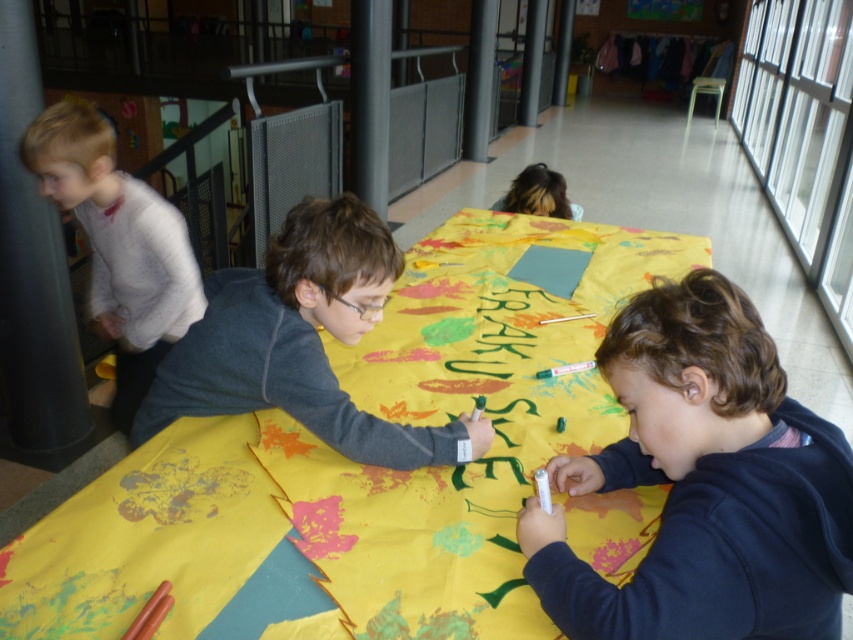
In the scene shown: Is yellow fabric at center smaller than dark blue sweatshirt at lower right?

Incorrect, yellow fabric at center is not smaller in size than dark blue sweatshirt at lower right.

Between yellow fabric at center and dark blue sweatshirt at lower right, which one is positioned lower?

dark blue sweatshirt at lower right is lower down.

Locate an element on the screen. yellow fabric at center is located at coordinates (361, 465).

Consider the image. Does dark blue sweatshirt at lower right have a larger size compared to blonde hair at upper center?

Correct, dark blue sweatshirt at lower right is larger in size than blonde hair at upper center.

Does dark blue sweatshirt at lower right have a smaller size compared to blonde hair at upper center?

Actually, dark blue sweatshirt at lower right might be larger than blonde hair at upper center.

Where is `dark blue sweatshirt at lower right`? dark blue sweatshirt at lower right is located at coordinates (704, 483).

Is dark blue sweatshirt at lower right bigger than white speckled sweater at left?

No, dark blue sweatshirt at lower right is not bigger than white speckled sweater at left.

Who is shorter, dark blue sweatshirt at lower right or white speckled sweater at left?

Standing shorter between the two is dark blue sweatshirt at lower right.

Is point (779, 518) farther from viewer compared to point (171, 237)?

No, it is not.

Locate an element on the screen. Image resolution: width=853 pixels, height=640 pixels. dark blue sweatshirt at lower right is located at coordinates (704, 483).